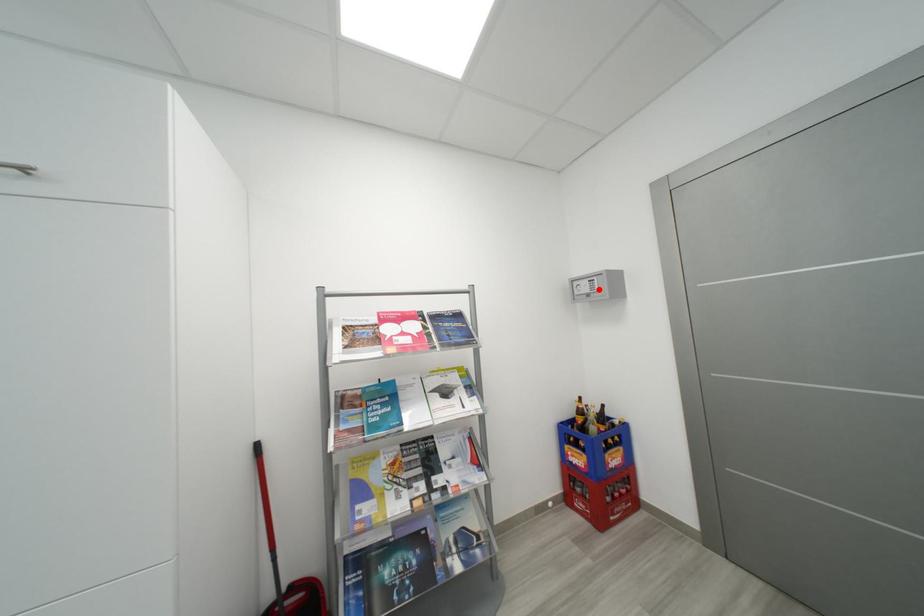
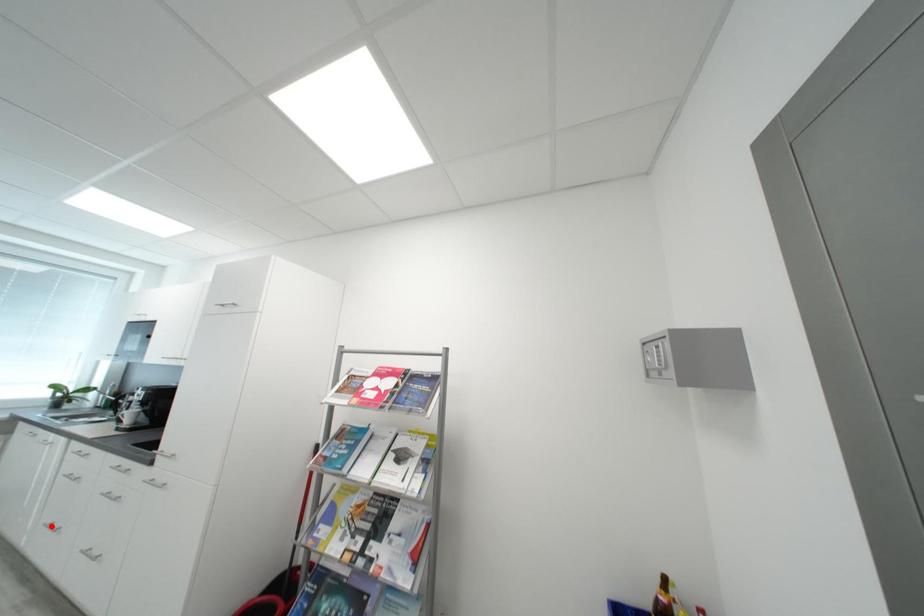
I am providing you with two images of the same scene from different viewpoints. A red point is marked on the first image and another point is marked on the second image. Do the highlighted points in image1 and image2 indicate the same real-world spot?

No